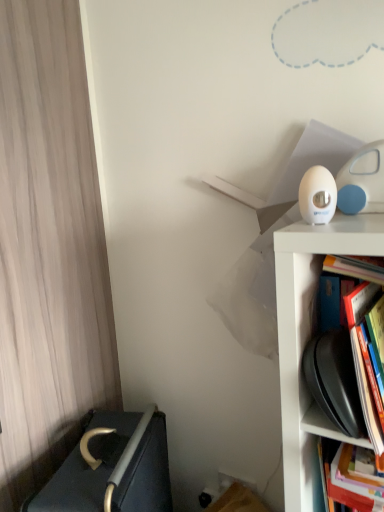
The height and width of the screenshot is (512, 384). Identify the location of hardcover book at right, which is the 1th book from top to bottom. (359, 343).

I want to click on hardcover book at right, positioned as the second book in top-to-bottom order, so click(x=341, y=480).

Between hardcover book at right, positioned as the second book in top-to-bottom order, and wooden curtain at left, which one has less height?

hardcover book at right, positioned as the second book in top-to-bottom order, is shorter.

Considering the relative sizes of hardcover book at right, positioned as the second book in top-to-bottom order, and wooden curtain at left in the image provided, is hardcover book at right, positioned as the second book in top-to-bottom order, wider than wooden curtain at left?

Yes, hardcover book at right, positioned as the second book in top-to-bottom order, is wider than wooden curtain at left.

This screenshot has width=384, height=512. Find the location of `the 1st book in front when counting from the wooden curtain at left`. the 1st book in front when counting from the wooden curtain at left is located at coordinates (341, 480).

Is hardcover book at right, arranged as the first book when ordered from the bottom, positioned far away from wooden curtain at left?

Actually, hardcover book at right, arranged as the first book when ordered from the bottom, and wooden curtain at left are a little close together.

Is point (94, 217) in front of point (349, 318)?

No, (94, 217) is behind (349, 318).

From the image's perspective, is wooden curtain at left located beneath hardcover book at right, which is the 1th book from top to bottom?

Incorrect, from the image's perspective, wooden curtain at left is higher than hardcover book at right, which is the 1th book from top to bottom.

Which is behind, point (1, 431) or point (344, 485)?

Point (1, 431)

Is wooden curtain at left at the right side of hardcover book at right, positioned as the second book in top-to-bottom order?

No.

Is wooden curtain at left smaller than hardcover book at right, positioned as the second book in top-to-bottom order?

No, wooden curtain at left is not smaller than hardcover book at right, positioned as the second book in top-to-bottom order.

Looking at this image, in terms of width, does wooden curtain at left look wider or thinner when compared to hardcover book at right, positioned as the second book in top-to-bottom order?

Clearly, wooden curtain at left has less width compared to hardcover book at right, positioned as the second book in top-to-bottom order.

Considering the sizes of objects hardcover book at right, positioned as the second book in top-to-bottom order, and hardcover book at right, which is the 2th book in bottom-to-top order, in the image provided, who is taller, hardcover book at right, positioned as the second book in top-to-bottom order, or hardcover book at right, which is the 2th book in bottom-to-top order,?

hardcover book at right, positioned as the second book in top-to-bottom order.

How much distance is there between hardcover book at right, arranged as the first book when ordered from the bottom, and hardcover book at right, which is the 1th book from top to bottom?

A distance of 7.62 inches exists between hardcover book at right, arranged as the first book when ordered from the bottom, and hardcover book at right, which is the 1th book from top to bottom.

Does hardcover book at right, arranged as the first book when ordered from the bottom, turn towards hardcover book at right, which is the 2th book in bottom-to-top order?

No, hardcover book at right, arranged as the first book when ordered from the bottom, does not turn towards hardcover book at right, which is the 2th book in bottom-to-top order.

From a real-world perspective, is hardcover book at right, positioned as the second book in top-to-bottom order, above or below hardcover book at right, which is the 1th book from top to bottom?

From a real-world perspective, hardcover book at right, positioned as the second book in top-to-bottom order, is physically below hardcover book at right, which is the 1th book from top to bottom.

Is hardcover book at right, positioned as the second book in top-to-bottom order, completely or partially outside of dark gray fabric bed at lower left?

hardcover book at right, positioned as the second book in top-to-bottom order, is positioned outside dark gray fabric bed at lower left.

Does hardcover book at right, arranged as the first book when ordered from the bottom, come in front of dark gray fabric bed at lower left?

Yes, hardcover book at right, arranged as the first book when ordered from the bottom, is in front of dark gray fabric bed at lower left.

From a real-world perspective, which is physically above, hardcover book at right, positioned as the second book in top-to-bottom order, or dark gray fabric bed at lower left?

In real-world perspective, hardcover book at right, positioned as the second book in top-to-bottom order, is above.

Could you tell me if hardcover book at right, positioned as the second book in top-to-bottom order, is facing dark gray fabric bed at lower left?

No, hardcover book at right, positioned as the second book in top-to-bottom order, is not aimed at dark gray fabric bed at lower left.

Can you confirm if hardcover book at right, which is the 1th book from top to bottom, is thinner than hardcover book at right, positioned as the second book in top-to-bottom order?

Indeed, hardcover book at right, which is the 1th book from top to bottom, has a lesser width compared to hardcover book at right, positioned as the second book in top-to-bottom order.

Which of these two, hardcover book at right, which is the 1th book from top to bottom, or hardcover book at right, positioned as the second book in top-to-bottom order, is bigger?

Bigger between the two is hardcover book at right, positioned as the second book in top-to-bottom order.

Considering their positions, is hardcover book at right, which is the 1th book from top to bottom, located in front of or behind hardcover book at right, positioned as the second book in top-to-bottom order?

hardcover book at right, which is the 1th book from top to bottom, is positioned closer to the viewer than hardcover book at right, positioned as the second book in top-to-bottom order.

Is hardcover book at right, which is the 2th book in bottom-to-top order, positioned with its back to hardcover book at right, positioned as the second book in top-to-bottom order?

No, hardcover book at right, which is the 2th book in bottom-to-top order, is not facing away from hardcover book at right, positioned as the second book in top-to-bottom order.

Would you say dark gray fabric bed at lower left contains wooden curtain at left?

Definitely not — wooden curtain at left is not inside dark gray fabric bed at lower left.

Find the location of `curtain above the dark gray fabric bed at lower left (from the image's perspective)`. curtain above the dark gray fabric bed at lower left (from the image's perspective) is located at coordinates (49, 249).

From the image's perspective, is dark gray fabric bed at lower left positioned above or below wooden curtain at left?

dark gray fabric bed at lower left is below wooden curtain at left.

From a real-world perspective, is dark gray fabric bed at lower left positioned above or below wooden curtain at left?

dark gray fabric bed at lower left is below wooden curtain at left.

From the wooden curtain at left, count 1st books forward and point to it. Please provide its 2D coordinates.

[(341, 480)]

Which book is the 1st one when counting from the right side of the wooden curtain at left? Please provide its 2D coordinates.

[(359, 343)]

When comparing their distances from hardcover book at right, positioned as the second book in top-to-bottom order, does dark gray fabric bed at lower left or wooden curtain at left seem further?

The object further to hardcover book at right, positioned as the second book in top-to-bottom order, is wooden curtain at left.

Which object lies nearer to the anchor point wooden curtain at left, hardcover book at right, arranged as the first book when ordered from the bottom, or dark gray fabric bed at lower left?

dark gray fabric bed at lower left is closer to wooden curtain at left.

Considering their positions, is dark gray fabric bed at lower left positioned closer to hardcover book at right, arranged as the first book when ordered from the bottom, than hardcover book at right, which is the 2th book in bottom-to-top order?

Among the two, hardcover book at right, which is the 2th book in bottom-to-top order, is located nearer to hardcover book at right, arranged as the first book when ordered from the bottom.

Considering their positions, is dark gray fabric bed at lower left positioned further to wooden curtain at left than hardcover book at right, which is the 2th book in bottom-to-top order?

The object further to wooden curtain at left is hardcover book at right, which is the 2th book in bottom-to-top order.

From the image, which object appears to be nearer to hardcover book at right, arranged as the first book when ordered from the bottom, hardcover book at right, which is the 2th book in bottom-to-top order, or dark gray fabric bed at lower left?

hardcover book at right, which is the 2th book in bottom-to-top order, is closer to hardcover book at right, arranged as the first book when ordered from the bottom.

Looking at the image, which one is located closer to dark gray fabric bed at lower left, hardcover book at right, which is the 1th book from top to bottom, or wooden curtain at left?

The object closer to dark gray fabric bed at lower left is wooden curtain at left.

Considering their positions, is hardcover book at right, positioned as the second book in top-to-bottom order, positioned further to hardcover book at right, which is the 2th book in bottom-to-top order, than dark gray fabric bed at lower left?

dark gray fabric bed at lower left is further to hardcover book at right, which is the 2th book in bottom-to-top order.

When comparing their distances from wooden curtain at left, does hardcover book at right, which is the 1th book from top to bottom, or dark gray fabric bed at lower left seem further?

hardcover book at right, which is the 1th book from top to bottom, lies further to wooden curtain at left than the other object.

Identify the location of writing located between wooden curtain at left and hardcover book at right, which is the 1th book from top to bottom, in the left-right direction. This screenshot has width=384, height=512. (113, 468).

Where is `book between dark gray fabric bed at lower left and hardcover book at right, positioned as the second book in top-to-bottom order, from left to right`? The width and height of the screenshot is (384, 512). book between dark gray fabric bed at lower left and hardcover book at right, positioned as the second book in top-to-bottom order, from left to right is located at coordinates (359, 343).

I want to click on book between wooden curtain at left and hardcover book at right, positioned as the second book in top-to-bottom order, from left to right, so click(x=359, y=343).

This screenshot has height=512, width=384. I want to click on writing between wooden curtain at left and hardcover book at right, arranged as the first book when ordered from the bottom, in the horizontal direction, so click(113, 468).